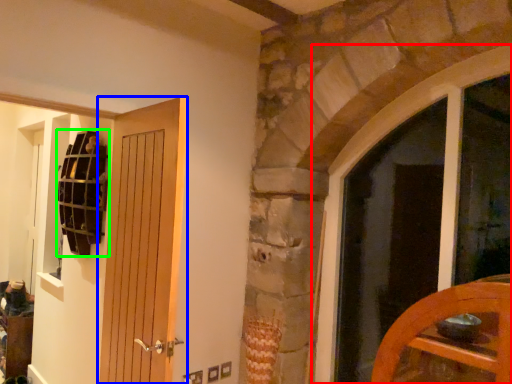
Question: Estimate the real-world distances between objects in this image. Which object is farther from window (highlighted by a red box), door (highlighted by a blue box) or shelf (highlighted by a green box)?

Choices:
 (A) door
 (B) shelf

Answer: (B)